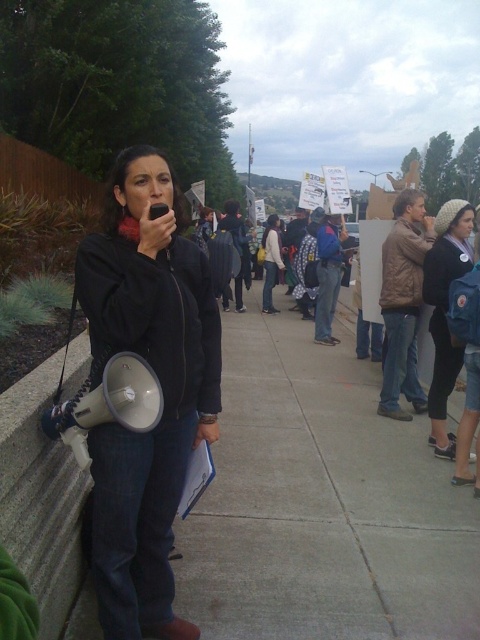
Question: Among these objects, which one is nearest to the camera?

Choices:
 (A) denim jacket at center
 (B) knitted wool hat at center

Answer: (A)

Question: Can you confirm if black matte jacket at center is positioned below knitted wool hat at center?

Choices:
 (A) yes
 (B) no

Answer: (A)

Question: Considering the real-world distances, which object is closest to the black matte jacket at center?

Choices:
 (A) denim jacket at center
 (B) knitted wool hat at center

Answer: (A)

Question: Is black matte jacket at center to the left of denim jacket at center from the viewer's perspective?

Choices:
 (A) yes
 (B) no

Answer: (A)

Question: Which point is farther to the camera?

Choices:
 (A) (446, 390)
 (B) (113, 204)

Answer: (A)

Question: Is denim jacket at center bigger than knitted wool hat at center?

Choices:
 (A) no
 (B) yes

Answer: (B)